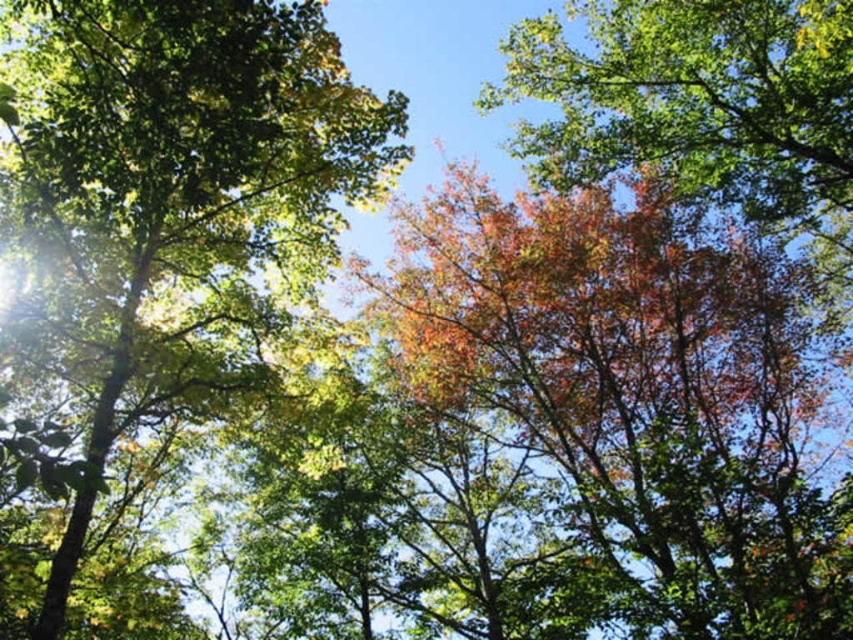
You are an ornithologist observing the forest canopy. You notice the autumn leaves at center and the green leafy tree at upper left. Which of these has a narrower width when viewed from above?

The autumn leaves at center is thinner than the green leafy tree at upper left, so the autumn leaves at center has a narrower width when viewed from above.

You are a bird flying through the forest canopy. You see the autumn leaves at center and the multicolored foliage at upper right. Which of these two objects is taller?

The multicolored foliage at upper right is taller than the autumn leaves at center.